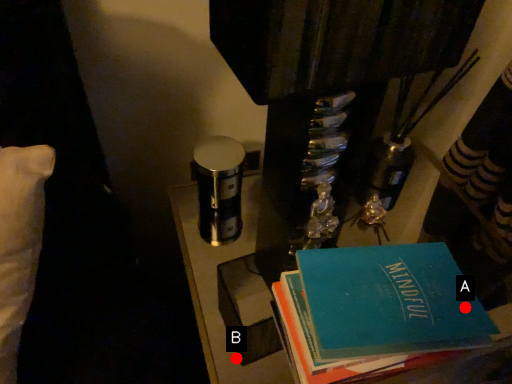
Question: Two points are circled on the image, labeled by A and B beside each circle. Which point is further to the camera?

Choices:
 (A) A is further
 (B) B is further

Answer: (B)